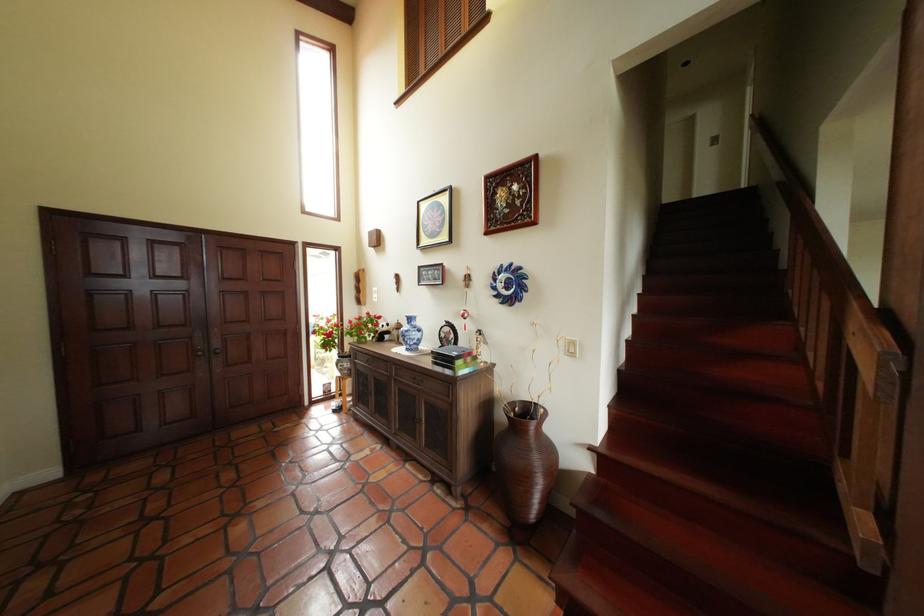
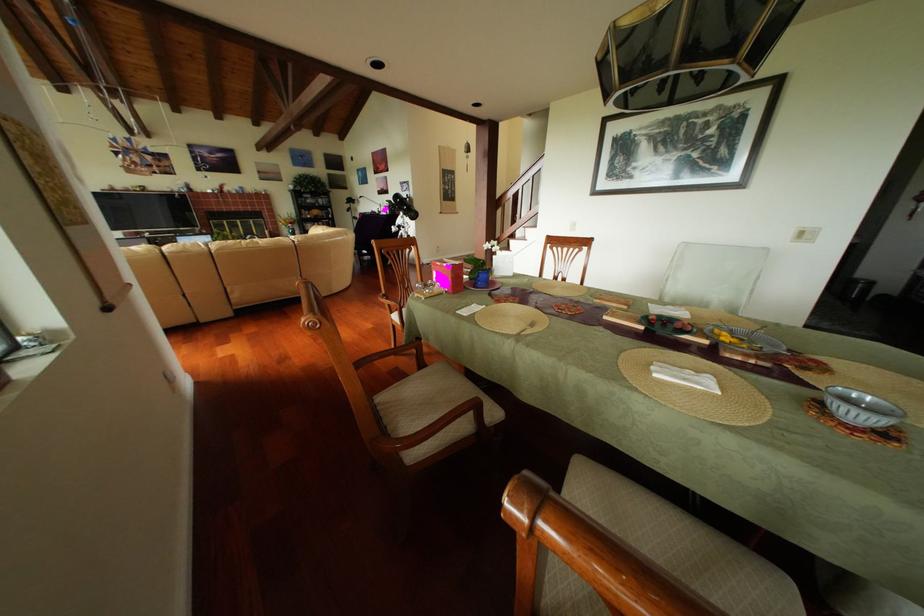
Question: I am providing you with two images of the same scene from different viewpoints. Which of the following objects are not visible in image2?

Choices:
 (A) cabinet door handle
 (B) chair sitting surface
 (C) cabinet recessed handle
 (D) wooden chair armrest

Answer: (A)